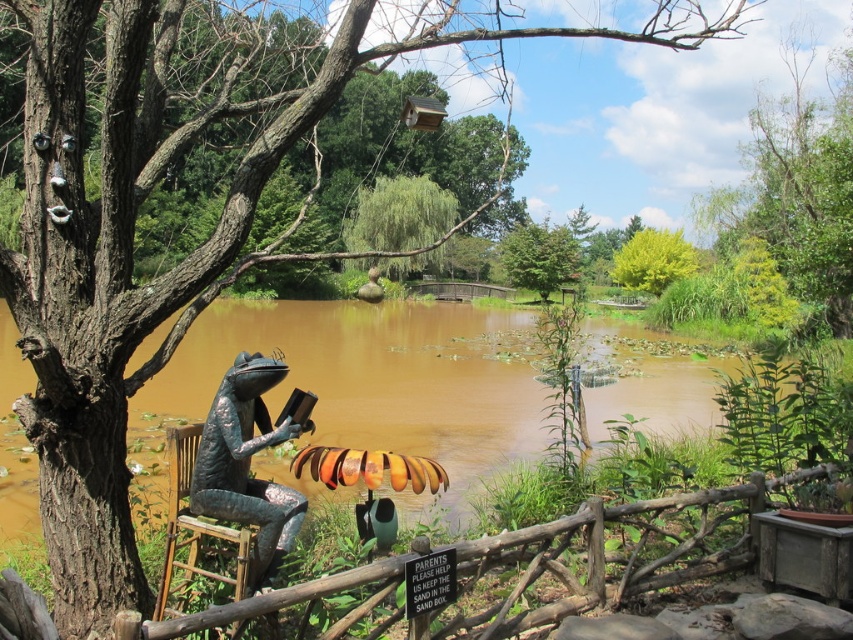
Between point (566, 252) and point (664, 230), which one is positioned behind?

The point (566, 252) is more distant.

Does green leafy tree at center come in front of yellow-green leafy tree at upper right?

No, green leafy tree at center is behind yellow-green leafy tree at upper right.

What are the coordinates of `green leafy tree at center` in the screenshot? It's located at (538, 257).

Can you confirm if green leafy tree at upper center is thinner than green leafy tree at center?

In fact, green leafy tree at upper center might be wider than green leafy tree at center.

Which is more to the left, green leafy tree at upper center or green leafy tree at center?

From the viewer's perspective, green leafy tree at center appears more on the left side.

Image resolution: width=853 pixels, height=640 pixels. Identify the location of green leafy tree at upper center. (796, 192).

What do you see at coordinates (796, 192) in the screenshot?
I see `green leafy tree at upper center` at bounding box center [796, 192].

Is green leafy tree at upper center wider than yellow-green leafy tree at upper right?

Yes, green leafy tree at upper center is wider than yellow-green leafy tree at upper right.

Is point (770, 192) positioned before point (628, 260)?

Yes, it is.

Find the location of `green leafy tree at upper center`. green leafy tree at upper center is located at coordinates (796, 192).